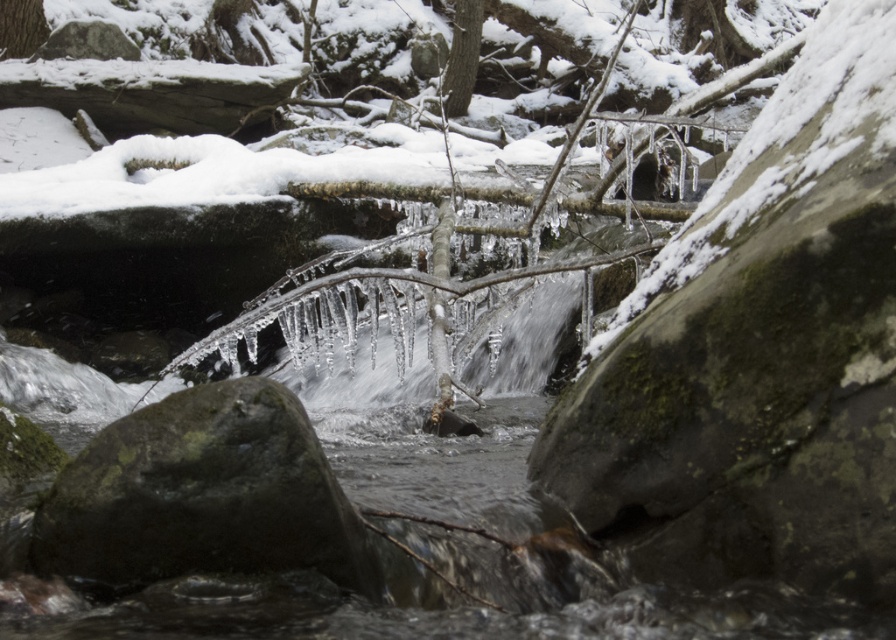
You are a hiker trying to cross the stream in the winter scene. You see the green mossy rock at center and the smooth bark tree at upper center. Which object is closer to you as you stand on the bank preparing to cross?

The green mossy rock at center is closer to you because it is in front of the smooth bark tree at upper center.